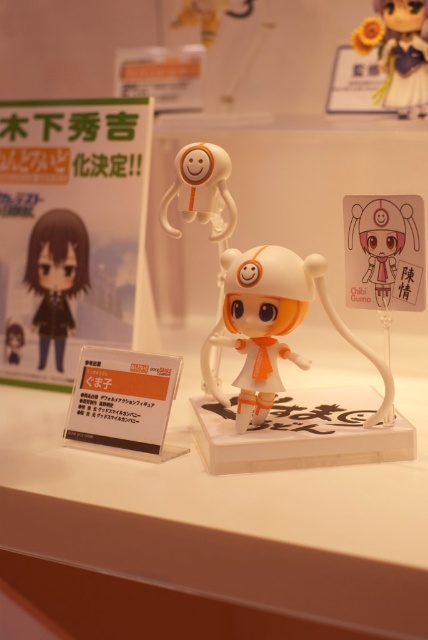
Is matte white plush at center positioned in front of matte black figure at center?

Yes, matte white plush at center is in front of matte black figure at center.

Measure the distance from matte white plush at center to matte black figure at center.

matte white plush at center is 23.38 inches away from matte black figure at center.

Who is more distant from viewer, (365, 288) or (56, 364)?

The point (56, 364) is more distant.

Identify the location of matte white plush at center. The image size is (428, 640). (383, 252).

Can you confirm if matte black figure at center is positioned above matte white figurine at upper right?

Actually, matte black figure at center is below matte white figurine at upper right.

Can you confirm if matte black figure at center is taller than matte white figurine at upper right?

Yes.

Measure the distance between matte black figure at center and camera.

They are 1.18 meters apart.

You are a GUI agent. You are given a task and a screenshot of the screen. Output one action in this format:
    pyautogui.click(x=<x>, y=<y>)
    Task: Click on the matte black figure at center
    The width and height of the screenshot is (428, 640).
    Given the screenshot: What is the action you would take?
    pyautogui.click(x=56, y=276)

Is white plastic ledge at center closer to camera compared to white glossy doll at center?

Yes, it is.

Who is more forward, (2, 424) or (264, 305)?

Positioned in front is point (264, 305).

Locate an element on the screen. The width and height of the screenshot is (428, 640). white plastic ledge at center is located at coordinates (225, 518).